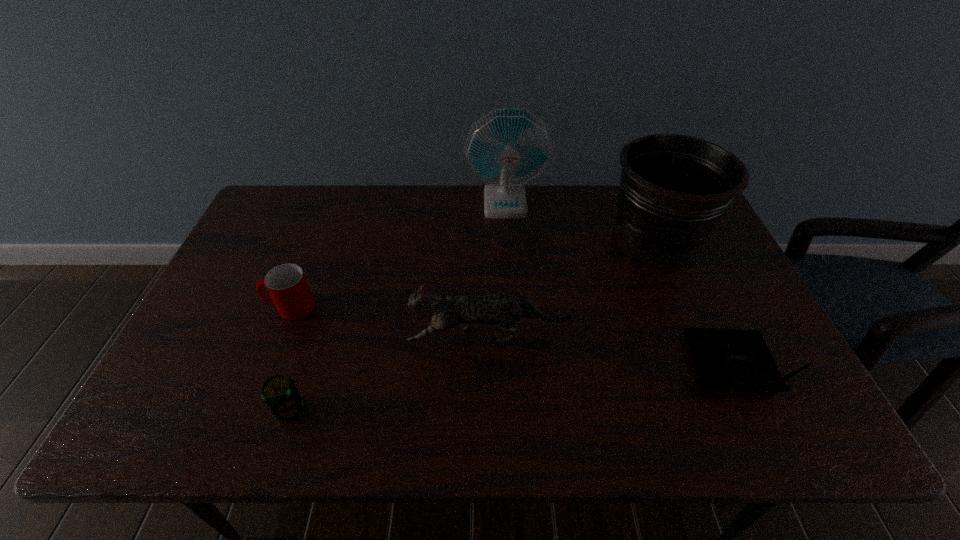
You are a GUI agent. You are given a task and a screenshot of the screen. Output one action in this format:
    pyautogui.click(x=<x>, y=<y>)
    Task: Click on the fan
    Image resolution: width=960 pixels, height=540 pixels.
    Given the screenshot: What is the action you would take?
    pyautogui.click(x=508, y=148)

Find the location of a particular element. the fifth shortest object is located at coordinates (674, 189).

What are the coordinates of `the third tallest object` in the screenshot? It's located at (504, 309).

The height and width of the screenshot is (540, 960). What are the coordinates of `the fourth nearest object` in the screenshot? It's located at (287, 285).

Where is `router`? Image resolution: width=960 pixels, height=540 pixels. router is located at coordinates (733, 359).

This screenshot has width=960, height=540. I want to click on beer can, so click(280, 394).

Locate an element on the screen. The image size is (960, 540). vacant region located in front of the tallest object to face the airflow is located at coordinates (509, 259).

Image resolution: width=960 pixels, height=540 pixels. I want to click on free space located on the front of the second tallest object, so click(680, 296).

You are a GUI agent. You are given a task and a screenshot of the screen. Output one action in this format:
    pyautogui.click(x=<x>, y=<y>)
    Task: Click on the vacant space located 0.120m on the face of the fourth shortest object
    Image resolution: width=960 pixels, height=540 pixels.
    Given the screenshot: What is the action you would take?
    pyautogui.click(x=360, y=337)

Find the location of a particular element. Image resolution: width=960 pixels, height=540 pixels. vacant region located 0.120m on the face of the fourth shortest object is located at coordinates (360, 337).